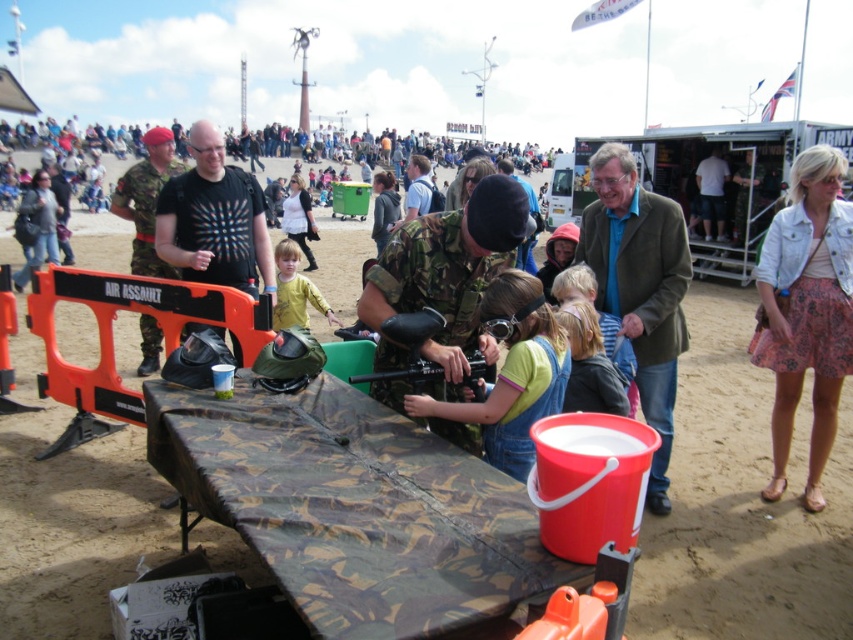
Question: Which object is positioned farthest from the dark blue jeans at center?

Choices:
 (A) matte black helmet at center
 (B) yellow matte shirt at center
 (C) denim jacket at center

Answer: (C)

Question: Does black matte t-shirt at center appear under dark blue jeans at center?

Choices:
 (A) yes
 (B) no

Answer: (A)

Question: Considering the real-world distances, which object is farthest from the denim overalls at center?

Choices:
 (A) camouflage fabric table at center
 (B) camouflage uniform at center
 (C) dark blue jeans at center

Answer: (C)

Question: Where is dark blue jeans at center located in relation to matte black helmet at center in the image?

Choices:
 (A) below
 (B) above

Answer: (B)

Question: Which point is farther to the camera?

Choices:
 (A) (709, 177)
 (B) (645, 337)
 (C) (495, 518)
 (D) (500, 307)

Answer: (A)

Question: Is denim overalls at center above camouflage uniform at center?

Choices:
 (A) yes
 (B) no

Answer: (B)